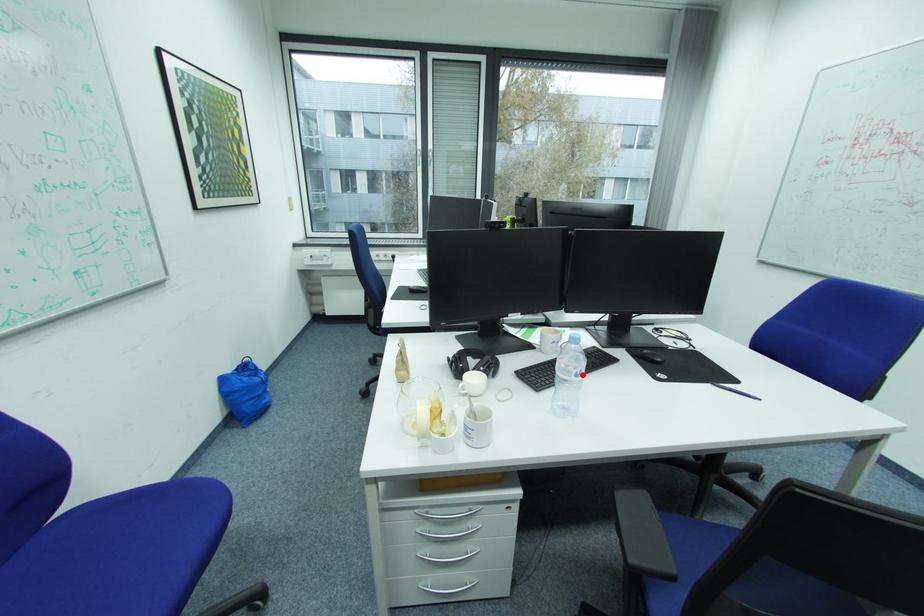
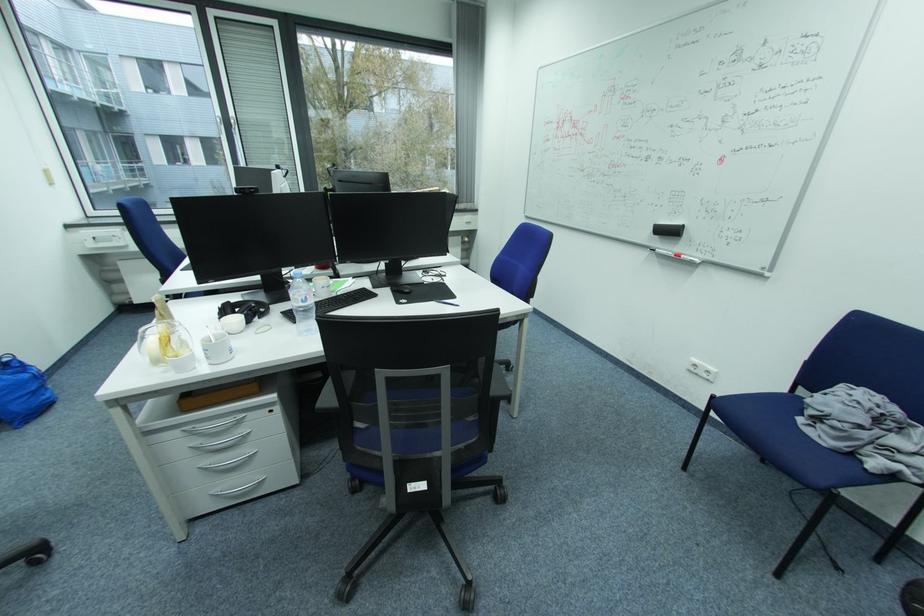
Question: I am providing you with two images of the same scene from different viewpoints. Image1 has a red point marked. In image2, the corresponding 3D location appears at what relative position? Reply with the corresponding letter.

Choices:
 (A) Closer
 (B) Farther

Answer: (A)